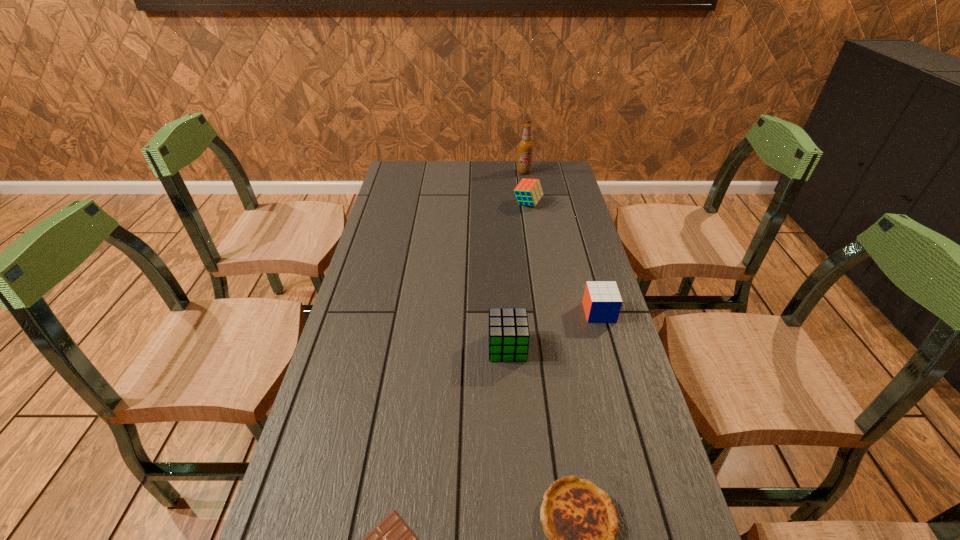
The height and width of the screenshot is (540, 960). Find the location of `the farthest object`. the farthest object is located at coordinates (526, 146).

Find the location of `the tallest object`. the tallest object is located at coordinates (526, 146).

What are the coordinates of `the farthest cube` in the screenshot? It's located at (528, 192).

I want to click on the second farthest object, so click(x=528, y=192).

Locate an element on the screen. the third nearest object is located at coordinates (508, 331).

Find the location of `the nearest cube`. the nearest cube is located at coordinates (508, 331).

The width and height of the screenshot is (960, 540). Identify the location of the rightmost object. (602, 302).

Where is `the second farthest cube`? This screenshot has height=540, width=960. the second farthest cube is located at coordinates (602, 302).

This screenshot has height=540, width=960. I want to click on vacant position located 0.110m on the front label of the tallest object, so [527, 189].

Where is `vacant area located on the back of the second cube from left to right`? The height and width of the screenshot is (540, 960). vacant area located on the back of the second cube from left to right is located at coordinates 524,177.